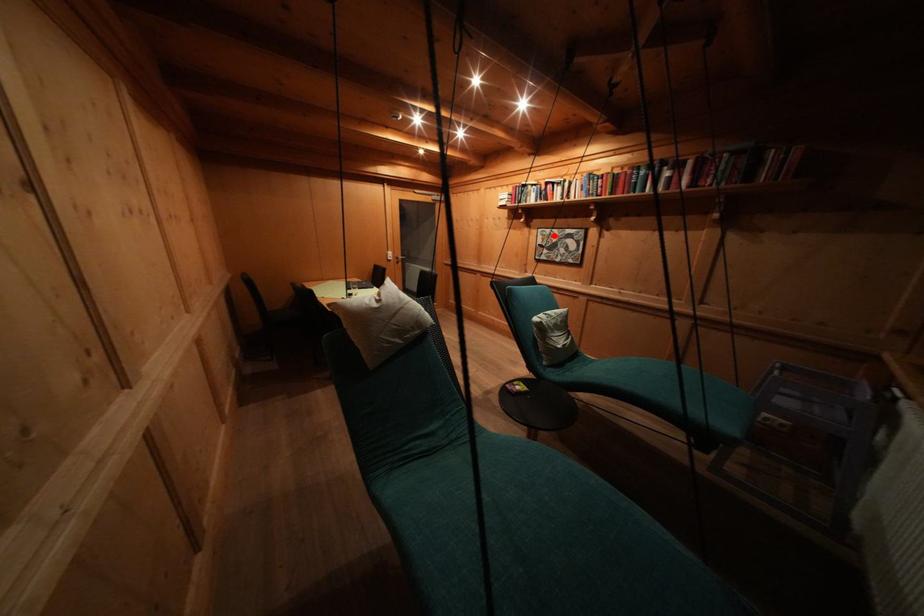
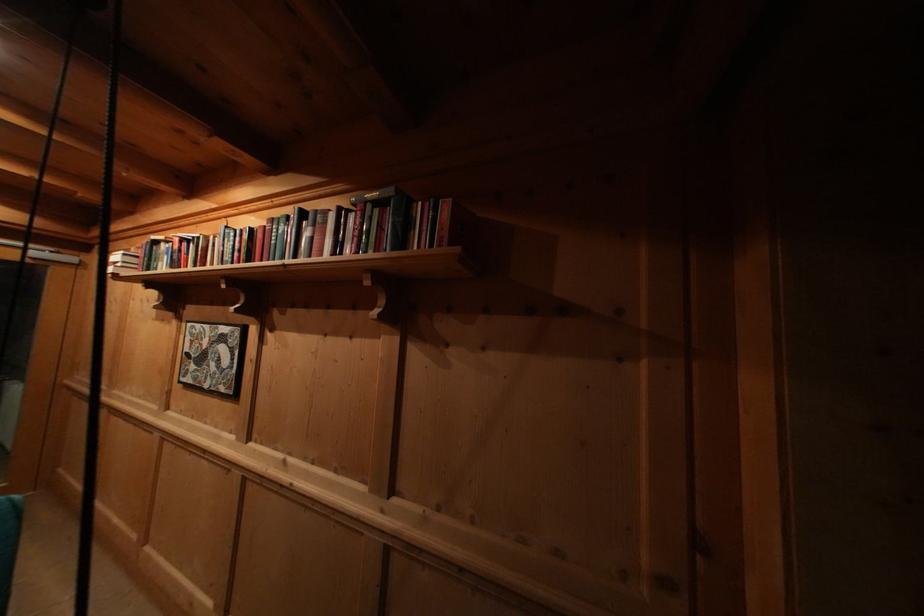
Find the pixel in the second image that matches the highlighted location in the first image.

(204, 331)